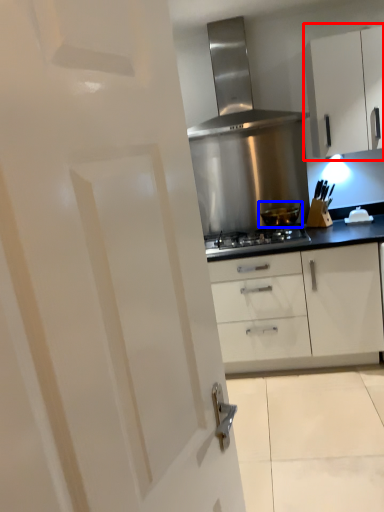
Question: Which object is closer to the camera taking this photo, cabinetry (highlighted by a red box) or kitchen appliance (highlighted by a blue box)?

Choices:
 (A) cabinetry
 (B) kitchen appliance

Answer: (A)